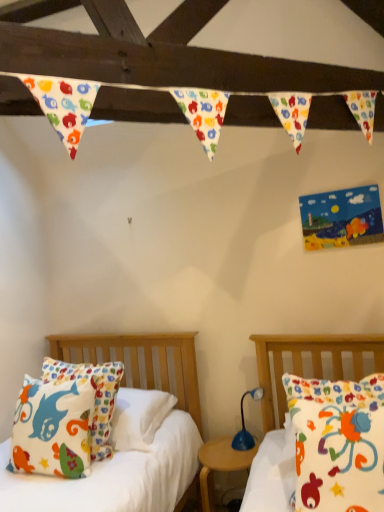
Question: Considering the relative sizes of matte cotton pillow at right, the first bed in the front-to-back sequence, and wooden nightstand at center in the image provided, is matte cotton pillow at right, the first bed in the front-to-back sequence, wider than wooden nightstand at center?

Choices:
 (A) yes
 (B) no

Answer: (B)

Question: Is the position of matte cotton pillow at right, the first bed in the front-to-back sequence, less distant than that of wooden nightstand at center?

Choices:
 (A) no
 (B) yes

Answer: (B)

Question: Is matte cotton pillow at right, arranged as the 2th bed when viewed from the left, facing towards wooden nightstand at center?

Choices:
 (A) no
 (B) yes

Answer: (A)

Question: Can you confirm if matte cotton pillow at right, the first bed in the front-to-back sequence, is bigger than wooden nightstand at center?

Choices:
 (A) yes
 (B) no

Answer: (A)

Question: From a real-world perspective, is matte cotton pillow at right, arranged as the 2th bed when viewed from the left, located beneath wooden nightstand at center?

Choices:
 (A) yes
 (B) no

Answer: (B)

Question: Considering the relative sizes of matte cotton pillow at right, positioned as the 2th bed in back-to-front order, and wooden nightstand at center in the image provided, is matte cotton pillow at right, positioned as the 2th bed in back-to-front order, smaller than wooden nightstand at center?

Choices:
 (A) yes
 (B) no

Answer: (B)

Question: Is blue plastic lamp at center not within matte cotton pillow at left, placed as the 2th bed when sorted from front to back?

Choices:
 (A) no
 (B) yes

Answer: (B)

Question: Is matte cotton pillow at left, acting as the first bed starting from the back, located within blue plastic lamp at center?

Choices:
 (A) yes
 (B) no

Answer: (B)

Question: From a real-world perspective, is blue plastic lamp at center located higher than matte cotton pillow at left, which ranks as the 1th bed in left-to-right order?

Choices:
 (A) yes
 (B) no

Answer: (B)

Question: From the image's perspective, is blue plastic lamp at center above matte cotton pillow at left, which ranks as the 2th bed in right-to-left order?

Choices:
 (A) yes
 (B) no

Answer: (B)

Question: Is blue plastic lamp at center wider than matte cotton pillow at left, which ranks as the 1th bed in left-to-right order?

Choices:
 (A) yes
 (B) no

Answer: (B)

Question: Can you confirm if blue plastic lamp at center is smaller than matte cotton pillow at left, acting as the first bed starting from the back?

Choices:
 (A) yes
 (B) no

Answer: (A)

Question: Are matte cotton pillow at left, which ranks as the 2th bed in right-to-left order, and blue plastic lamp at center located far from each other?

Choices:
 (A) yes
 (B) no

Answer: (B)